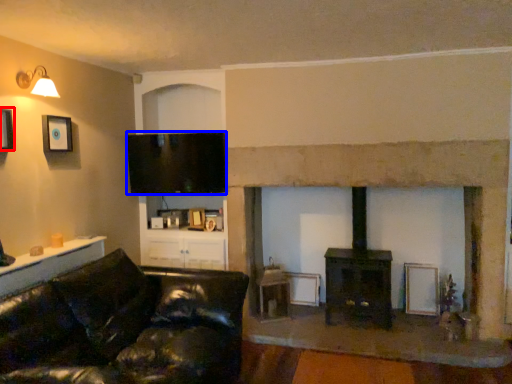
Question: Which object appears closest to the camera in this image, picture frame (highlighted by a red box) or television (highlighted by a blue box)?

Choices:
 (A) picture frame
 (B) television

Answer: (A)